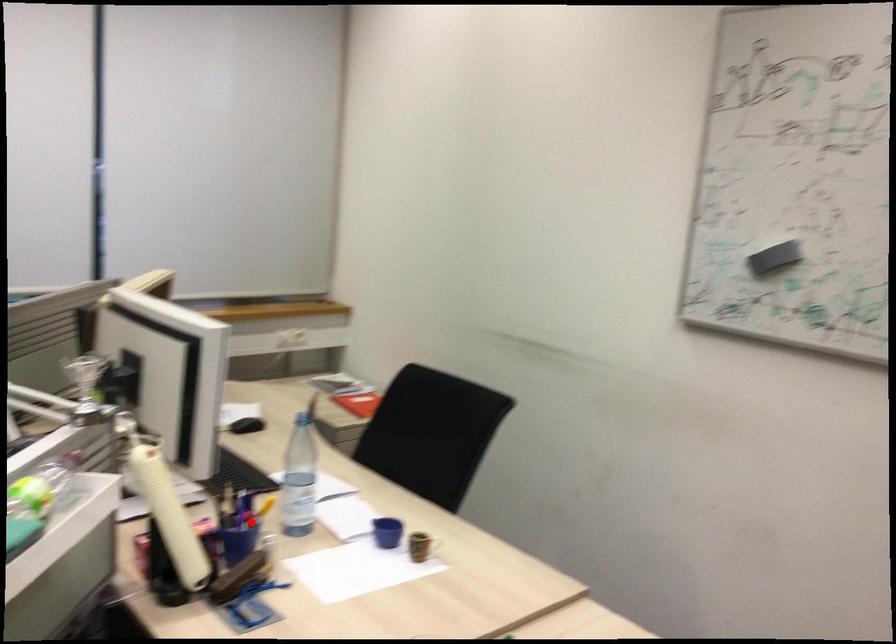
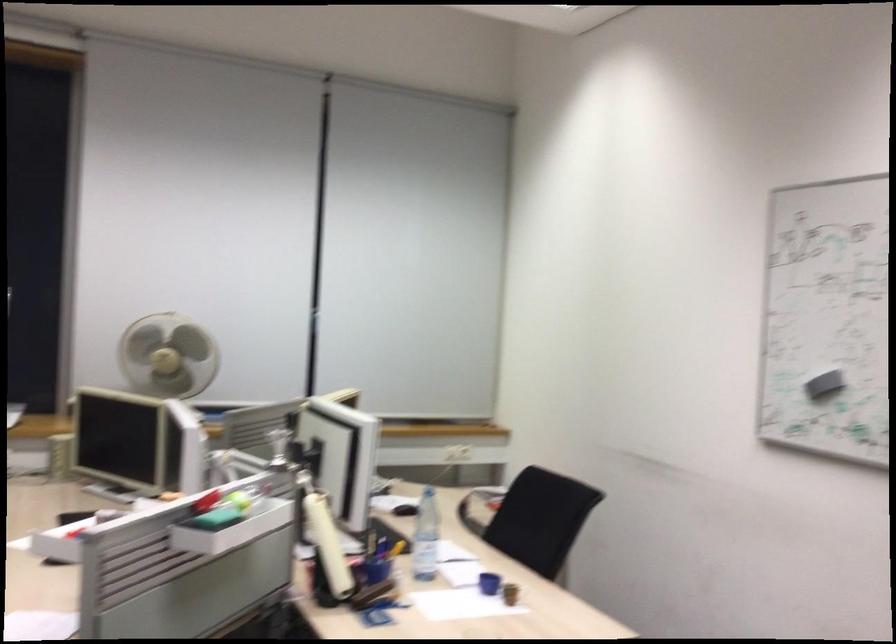
In the second image, find the point that corresponds to the highlighted location in the first image.

(377, 563)